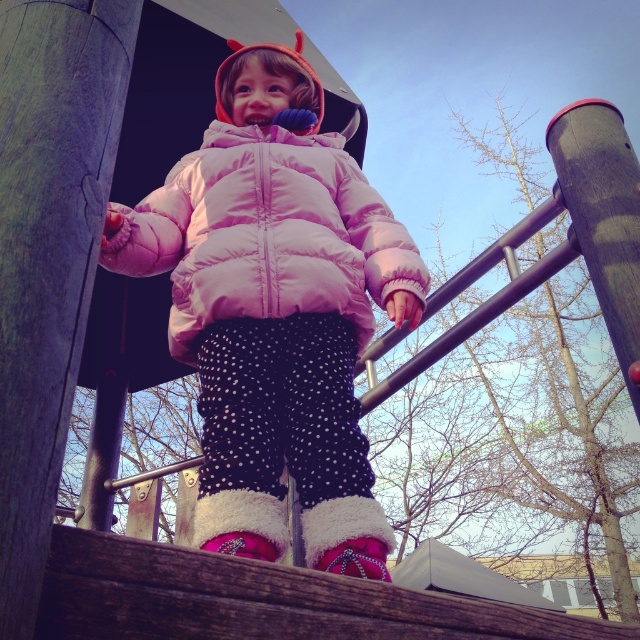
Does pink puffy jacket at center have a greater width compared to pink quilted jacket at center?

Indeed, pink puffy jacket at center has a greater width compared to pink quilted jacket at center.

Does point (422, 294) come farther from viewer compared to point (156, 208)?

No, it is in front of (156, 208).

Where is `pink puffy jacket at center`? The image size is (640, 640). pink puffy jacket at center is located at coordinates (275, 310).

Based on the photo, measure the distance between pink puffy jacket at center and smooth gray pole at upper right.

The distance of pink puffy jacket at center from smooth gray pole at upper right is 89.60 centimeters.

Looking at this image, can you confirm if pink puffy jacket at center is bigger than smooth gray pole at upper right?

Correct, pink puffy jacket at center is larger in size than smooth gray pole at upper right.

Where is `pink puffy jacket at center`? pink puffy jacket at center is located at coordinates (275, 310).

Does pink quilted jacket at center have a greater height compared to smooth gray pole at upper right?

Incorrect, pink quilted jacket at center's height is not larger of smooth gray pole at upper right's.

Between pink quilted jacket at center and smooth gray pole at upper right, which one has more height?

smooth gray pole at upper right is taller.

The height and width of the screenshot is (640, 640). What do you see at coordinates (266, 236) in the screenshot?
I see `pink quilted jacket at center` at bounding box center [266, 236].

Where is `pink quilted jacket at center`? Image resolution: width=640 pixels, height=640 pixels. pink quilted jacket at center is located at coordinates (266, 236).